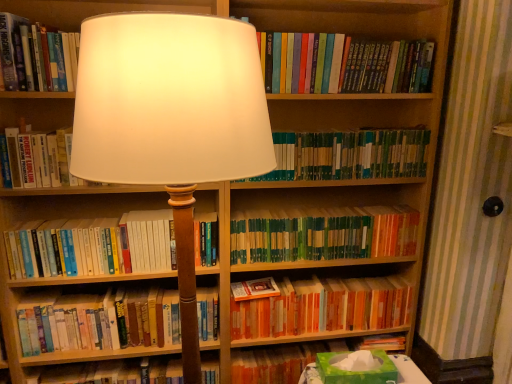
I want to click on orange paperbacks at center, marked as the 7th book in a top-to-bottom arrangement, so click(x=324, y=307).

How much space does white paper book at center, placed as the 5th book when sorted from bottom to top, occupy vertically?

The height of white paper book at center, placed as the 5th book when sorted from bottom to top, is 9.18 inches.

Measure the distance between matte white lampshade at center and camera.

The distance of matte white lampshade at center from camera is 29.05 inches.

This screenshot has height=384, width=512. I want to click on hardcover books at left, which is counted as the 6th book, starting from the top, so click(92, 246).

Locate an element on the screen. The image size is (512, 384). hardcover book at upper left, which is the 2th book in top-to-bottom order is located at coordinates (37, 56).

At what (x,y) coordinates should I click in order to perform the action: click on orange paperbacks at center, the second book when ordered from bottom to top. Please return your answer as a coordinate pair (x, y). Looking at the image, I should click on (324, 307).

Relative to green matte bookshelf at center, the fifth book when ordered from top to bottom, is orange paperbacks at center, the second book when ordered from bottom to top, in front or behind?

In the image, orange paperbacks at center, the second book when ordered from bottom to top, appears behind green matte bookshelf at center, the fifth book when ordered from top to bottom.

Is orange paperbacks at center, marked as the 7th book in a top-to-bottom arrangement, not close to green matte bookshelf at center, the fifth book when ordered from top to bottom?

No, orange paperbacks at center, marked as the 7th book in a top-to-bottom arrangement, is not far away from green matte bookshelf at center, the fifth book when ordered from top to bottom.

Which object is positioned more to the right, orange paperbacks at center, marked as the 7th book in a top-to-bottom arrangement, or green matte bookshelf at center, the fifth book when ordered from top to bottom?

green matte bookshelf at center, the fifth book when ordered from top to bottom.

In the scene shown: From a real-world perspective, is orange paperbacks at center, the second book when ordered from bottom to top, positioned above or below green matte bookshelf at center, the fifth book when ordered from top to bottom?

Answer: From a real-world perspective, orange paperbacks at center, the second book when ordered from bottom to top, is physically below green matte bookshelf at center, the fifth book when ordered from top to bottom.

At what (x,y) coordinates should I click in order to perform the action: click on lamp below the hardcover book at upper left, positioned as the 7th book in bottom-to-top order (from the image's perspective). Please return your answer as a coordinate pair (x, y). Looking at the image, I should click on (170, 120).

Which of these two, matte white lampshade at center or hardcover book at upper left, which is the 2th book in top-to-bottom order, is wider?

matte white lampshade at center is wider.

From the image's perspective, does matte white lampshade at center appear lower than hardcover book at upper left, positioned as the 7th book in bottom-to-top order?

Yes.

Is matte white lampshade at center in front of or behind hardcover book at upper left, positioned as the 7th book in bottom-to-top order, in the image?

In the image, matte white lampshade at center appears in front of hardcover book at upper left, positioned as the 7th book in bottom-to-top order.

Is matte white lampshade at center not inside green matte bookshelf at center, the fifth book when ordered from top to bottom?

Absolutely, matte white lampshade at center is external to green matte bookshelf at center, the fifth book when ordered from top to bottom.

Between matte white lampshade at center and green matte bookshelf at center, the fifth book when ordered from top to bottom, which one appears on the left side from the viewer's perspective?

Positioned to the left is matte white lampshade at center.

Is matte white lampshade at center positioned with its back to green matte bookshelf at center, placed as the 4th book when sorted from bottom to top?

matte white lampshade at center does not have its back to green matte bookshelf at center, placed as the 4th book when sorted from bottom to top.

Can you see hardcover books at left, the 3th book from the bottom, touching white paper book at center, placed as the 5th book when sorted from bottom to top?

No, hardcover books at left, the 3th book from the bottom, is not with white paper book at center, placed as the 5th book when sorted from bottom to top.

Which book is the 2nd one when counting from the front of the hardcover books at left, the 3th book from the bottom? Please provide its 2D coordinates.

[(38, 159)]

From a real-world perspective, which object stands above the other?

In real-world perspective, white paper book at center, placed as the 5th book when sorted from bottom to top, is above.

Does hardcover books at left, which is counted as the 6th book, starting from the top, come behind white paper book at center, acting as the fourth book starting from the top?

Yes.

Could you tell me if hardcover books at upper center, acting as the 8th book starting from the bottom, is turned towards white paper book at center, placed as the 5th book when sorted from bottom to top?

No, hardcover books at upper center, acting as the 8th book starting from the bottom, is not aimed at white paper book at center, placed as the 5th book when sorted from bottom to top.

Is hardcover books at upper center, acting as the 8th book starting from the bottom, next to white paper book at center, placed as the 5th book when sorted from bottom to top, and touching it?

No, hardcover books at upper center, acting as the 8th book starting from the bottom, is not next to white paper book at center, placed as the 5th book when sorted from bottom to top.

Can you confirm if hardcover books at upper center, acting as the first book starting from the top, is bigger than white paper book at center, placed as the 5th book when sorted from bottom to top?

Actually, hardcover books at upper center, acting as the first book starting from the top, might be smaller than white paper book at center, placed as the 5th book when sorted from bottom to top.

Considering the sizes of objects hardcover books at upper center, acting as the 8th book starting from the bottom, and white paper book at center, placed as the 5th book when sorted from bottom to top, in the image provided, who is taller, hardcover books at upper center, acting as the 8th book starting from the bottom, or white paper book at center, placed as the 5th book when sorted from bottom to top,?

hardcover books at upper center, acting as the 8th book starting from the bottom.

Is hardcover books at upper center, acting as the 8th book starting from the bottom, oriented away from orange paperbacks at center, marked as the 7th book in a top-to-bottom arrangement?

No, hardcover books at upper center, acting as the 8th book starting from the bottom, is not facing away from orange paperbacks at center, marked as the 7th book in a top-to-bottom arrangement.

How different are the orientations of hardcover books at upper center, acting as the 8th book starting from the bottom, and orange paperbacks at center, marked as the 7th book in a top-to-bottom arrangement, in degrees?

hardcover books at upper center, acting as the 8th book starting from the bottom, and orange paperbacks at center, marked as the 7th book in a top-to-bottom arrangement, are facing 0.000844 degrees away from each other.

Would you consider hardcover books at upper center, acting as the first book starting from the top, to be distant from orange paperbacks at center, the second book when ordered from bottom to top?

No, hardcover books at upper center, acting as the first book starting from the top, is not far from orange paperbacks at center, the second book when ordered from bottom to top.

Is hardcover books at upper center, acting as the 8th book starting from the bottom, completely or partially outside of orange paperbacks at center, marked as the 7th book in a top-to-bottom arrangement?

Yes, hardcover books at upper center, acting as the 8th book starting from the bottom, is located beyond the bounds of orange paperbacks at center, marked as the 7th book in a top-to-bottom arrangement.

Is hardcover books at upper center, acting as the first book starting from the top, far away from matte white lampshade at center?

They are positioned close to each other.

Consider the image. Is hardcover books at upper center, acting as the first book starting from the top, taller or shorter than matte white lampshade at center?

Clearly, hardcover books at upper center, acting as the first book starting from the top, is shorter compared to matte white lampshade at center.

Is hardcover books at upper center, acting as the 8th book starting from the bottom, wider than matte white lampshade at center?

Incorrect, the width of hardcover books at upper center, acting as the 8th book starting from the bottom, does not surpass that of matte white lampshade at center.

From the picture: From the image's perspective, is hardcover books at upper center, acting as the first book starting from the top, below matte white lampshade at center?

No, from the image's perspective, hardcover books at upper center, acting as the first book starting from the top, is not below matte white lampshade at center.

Locate an element on the screen. book behind the green matte bookshelf at center, the fifth book when ordered from top to bottom is located at coordinates (324, 307).

Where is `lamp lying below the hardcover book at upper left, which is the 2th book in top-to-bottom order (from the image's perspective)`? This screenshot has height=384, width=512. lamp lying below the hardcover book at upper left, which is the 2th book in top-to-bottom order (from the image's perspective) is located at coordinates (170, 120).

Consider the image. Estimate the real-world distances between objects in this image. Which object is closer to hardcover books at left, the 3th book from the bottom, hardcover books at upper center, acting as the first book starting from the top, or green matte book at center, the third book from the top?

green matte book at center, the third book from the top, is positioned closer to the anchor hardcover books at left, the 3th book from the bottom.

Estimate the real-world distances between objects in this image. Which object is further from hardcover books at upper center, acting as the 8th book starting from the bottom, hardcover books at left, the 3th book from the bottom, or matte white lampshade at center?

hardcover books at left, the 3th book from the bottom, is positioned further to the anchor hardcover books at upper center, acting as the 8th book starting from the bottom.

Based on their spatial positions, is hardcover book at center, the 1th book when ordered from bottom to top, or matte white lampshade at center further from hardcover books at upper center, acting as the first book starting from the top?

hardcover book at center, the 1th book when ordered from bottom to top, is positioned further to the anchor hardcover books at upper center, acting as the first book starting from the top.

Estimate the real-world distances between objects in this image. Which object is closer to hardcover books at upper center, acting as the first book starting from the top, orange paperbacks at center, the second book when ordered from bottom to top, or hardcover books at left, the 3th book from the bottom?

Based on the image, hardcover books at left, the 3th book from the bottom, appears to be nearer to hardcover books at upper center, acting as the first book starting from the top.

Estimate the real-world distances between objects in this image. Which object is closer to hardcover books at upper center, acting as the first book starting from the top, matte white lampshade at center or hardcover book at upper left, which is the 2th book in top-to-bottom order?

Among the two, matte white lampshade at center is located nearer to hardcover books at upper center, acting as the first book starting from the top.

Considering their positions, is hardcover books at upper center, acting as the 8th book starting from the bottom, positioned further to white paper book at center, acting as the fourth book starting from the top, than matte white lampshade at center?

hardcover books at upper center, acting as the 8th book starting from the bottom, is positioned further to the anchor white paper book at center, acting as the fourth book starting from the top.

Which object lies nearer to the anchor point matte white lampshade at center, hardcover book at upper left, which is the 2th book in top-to-bottom order, or green matte bookshelf at center, placed as the 4th book when sorted from bottom to top?

hardcover book at upper left, which is the 2th book in top-to-bottom order.

Considering their positions, is hardcover books at upper center, acting as the 8th book starting from the bottom, positioned closer to orange paperbacks at center, marked as the 7th book in a top-to-bottom arrangement, than white paper book at center, placed as the 5th book when sorted from bottom to top?

hardcover books at upper center, acting as the 8th book starting from the bottom, is positioned closer to the anchor orange paperbacks at center, marked as the 7th book in a top-to-bottom arrangement.

Where is `book between white paper book at center, acting as the fourth book starting from the top, and orange paperbacks at center, marked as the 7th book in a top-to-bottom arrangement, from left to right`? Image resolution: width=512 pixels, height=384 pixels. book between white paper book at center, acting as the fourth book starting from the top, and orange paperbacks at center, marked as the 7th book in a top-to-bottom arrangement, from left to right is located at coordinates coord(92,246).

Find the location of a particular element. The width and height of the screenshot is (512, 384). lamp between hardcover books at upper center, acting as the 8th book starting from the bottom, and hardcover book at center, the 8th book viewed from the top, in the up-down direction is located at coordinates (170, 120).

The image size is (512, 384). Find the location of `lamp located between hardcover book at upper left, positioned as the 7th book in bottom-to-top order, and green matte bookshelf at center, placed as the 4th book when sorted from bottom to top, in the left-right direction`. lamp located between hardcover book at upper left, positioned as the 7th book in bottom-to-top order, and green matte bookshelf at center, placed as the 4th book when sorted from bottom to top, in the left-right direction is located at coordinates (170, 120).

Where is `lamp situated between hardcover book at upper left, positioned as the 7th book in bottom-to-top order, and hardcover books at upper center, acting as the 8th book starting from the bottom, from left to right`? The image size is (512, 384). lamp situated between hardcover book at upper left, positioned as the 7th book in bottom-to-top order, and hardcover books at upper center, acting as the 8th book starting from the bottom, from left to right is located at coordinates tap(170, 120).